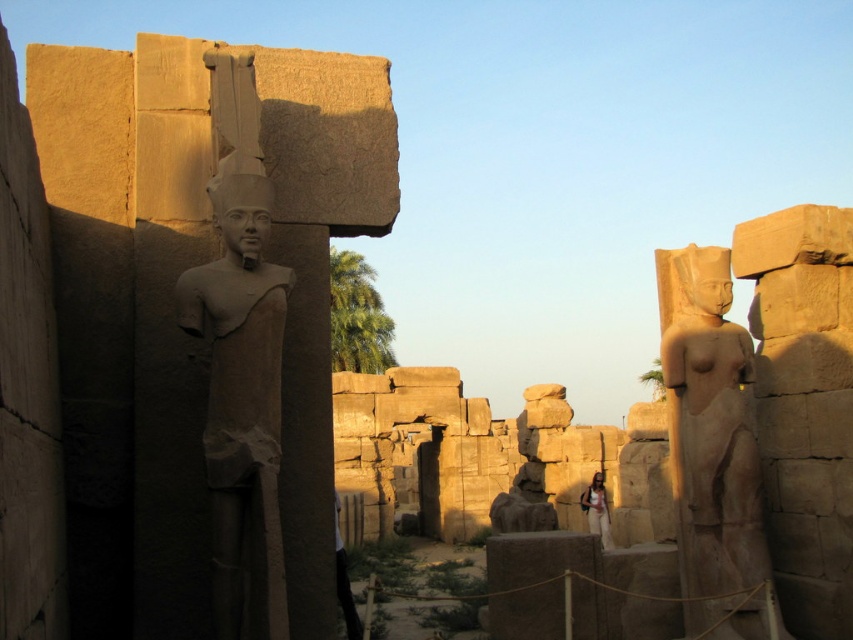
Question: Which of the following is the farthest from the observer?

Choices:
 (A) smooth beige statue at right
 (B) light brown stone statue at center
 (C) gray stone statue at left

Answer: (B)

Question: Where is smooth beige statue at right located in relation to light brown stone statue at center in the image?

Choices:
 (A) right
 (B) left

Answer: (B)

Question: Does smooth beige statue at right appear on the right side of light brown stone statue at center?

Choices:
 (A) yes
 (B) no

Answer: (B)

Question: Which point is farther to the camera?

Choices:
 (A) smooth beige statue at right
 (B) gray stone statue at left

Answer: (A)

Question: Does gray stone statue at left appear on the right side of smooth beige statue at right?

Choices:
 (A) no
 (B) yes

Answer: (A)

Question: Which point is closer to the camera?

Choices:
 (A) (689, 577)
 (B) (608, 524)
 (C) (259, 486)

Answer: (C)